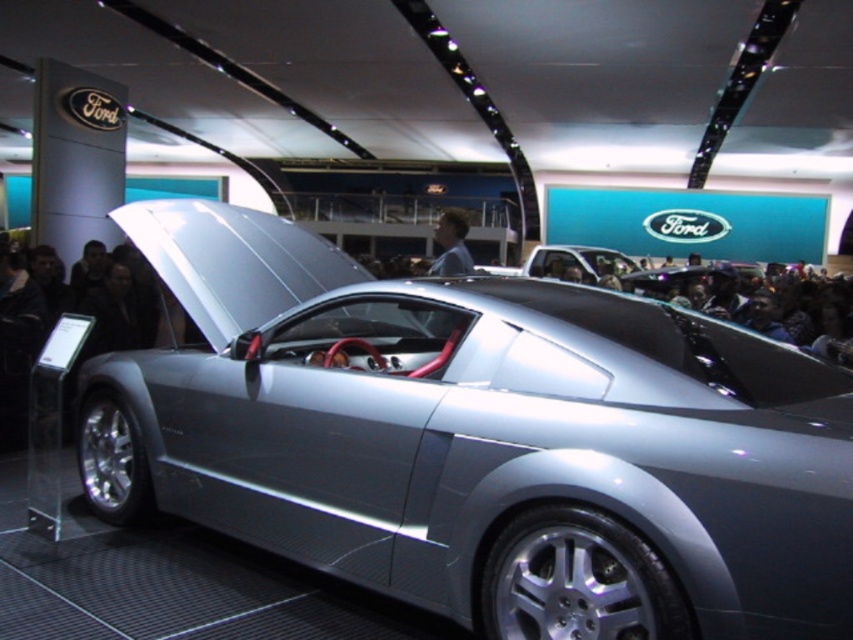
Question: Which point is closer to the camera?

Choices:
 (A) smooth skin face at center
 (B) satin silver car at center

Answer: (A)

Question: Is satin silver car at center positioned in front of smooth skin face at center?

Choices:
 (A) no
 (B) yes

Answer: (A)

Question: Does satin silver car at center appear under smooth skin face at center?

Choices:
 (A) yes
 (B) no

Answer: (A)

Question: Does satin silver car at center appear over smooth skin face at center?

Choices:
 (A) no
 (B) yes

Answer: (A)